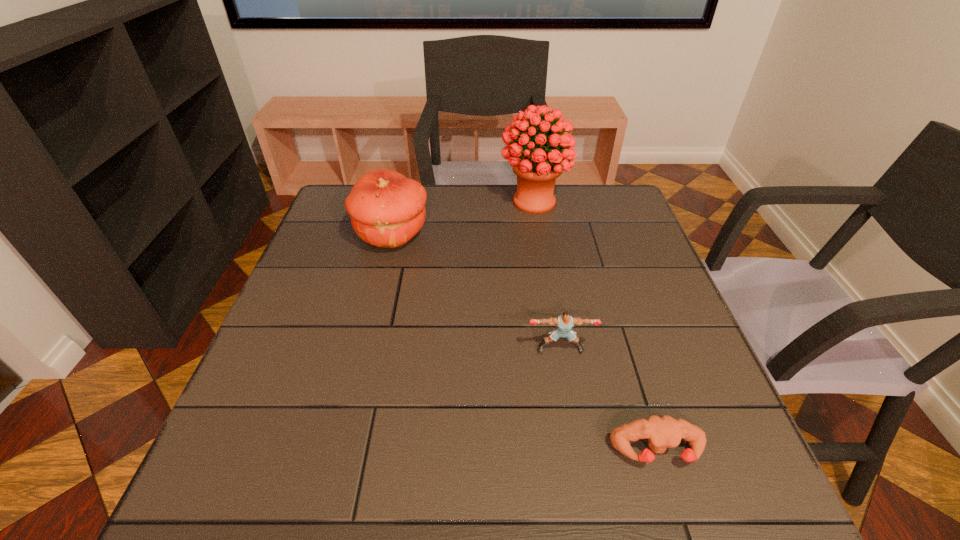
You are a GUI agent. You are given a task and a screenshot of the screen. Output one action in this format:
    pyautogui.click(x=<x>, y=<y>)
    Task: Click on the bouquet that is at the far edge
    
    Given the screenshot: What is the action you would take?
    pyautogui.click(x=536, y=170)

This screenshot has width=960, height=540. I want to click on pumpkin present at the far edge, so click(x=387, y=209).

This screenshot has height=540, width=960. What are the coordinates of `object present at the near edge` in the screenshot? It's located at (661, 432).

The height and width of the screenshot is (540, 960). I want to click on object present at the left edge, so click(x=387, y=209).

Find the location of a particular element. object that is at the right edge is located at coordinates (661, 432).

This screenshot has height=540, width=960. Identify the location of object at the far left corner. (387, 209).

Where is `object located in the near right corner section of the desktop`? object located in the near right corner section of the desktop is located at coordinates click(661, 432).

This screenshot has height=540, width=960. I want to click on free region at the far edge of the desktop, so click(x=482, y=206).

You are a GUI agent. You are given a task and a screenshot of the screen. Output one action in this format:
    pyautogui.click(x=<x>, y=<y>)
    Task: Click on the vacant region at the near edge
    The image size is (960, 540).
    Given the screenshot: What is the action you would take?
    pyautogui.click(x=388, y=484)

In the image, there is a desktop. Where is `blank space at the left edge`? The height and width of the screenshot is (540, 960). blank space at the left edge is located at coordinates (253, 375).